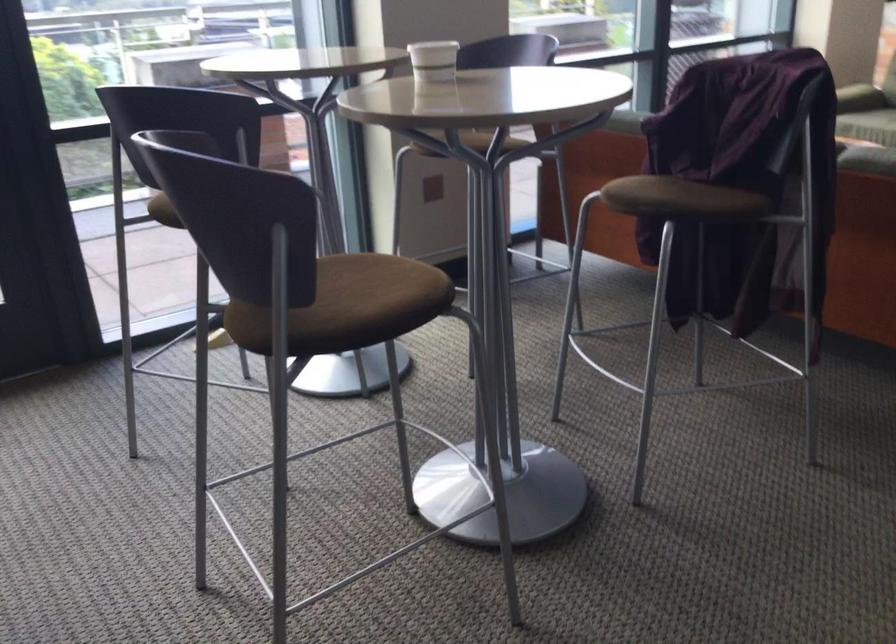
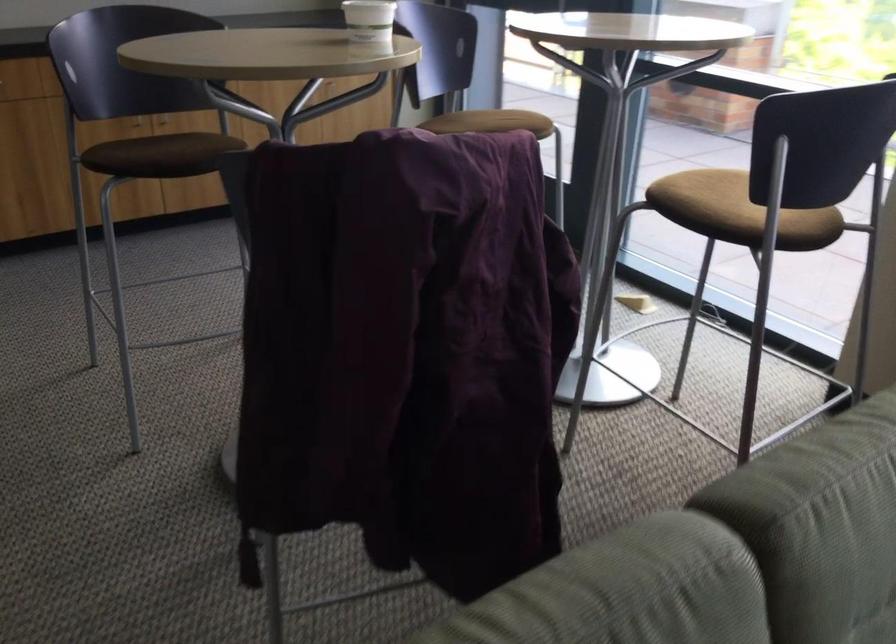
Question: I am providing you with two images of the same scene from different viewpoints. Please identify which objects are invisible in image2.

Choices:
 (A) white paper cup
 (B) brown chair sitting surface
 (C) wicker hamper
 (D) cabinet handle

Answer: (B)